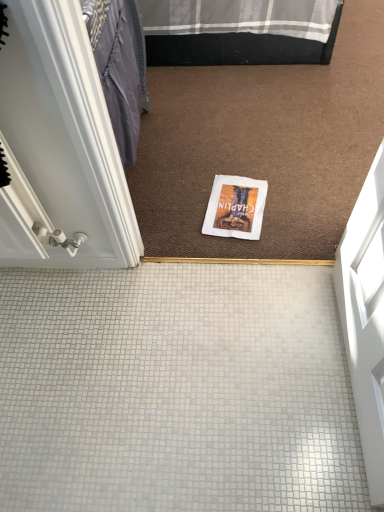
Image resolution: width=384 pixels, height=512 pixels. What are the coordinates of `vacant area on top of white tile floor at center (from a real-world perspective)` in the screenshot? It's located at (149, 375).